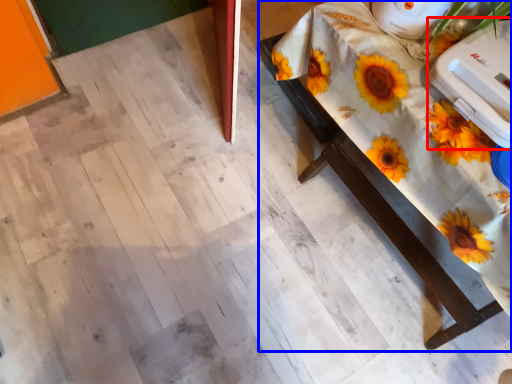
Question: Which object appears closest to the camera in this image, appliance (highlighted by a red box) or table (highlighted by a blue box)?

Choices:
 (A) appliance
 (B) table

Answer: (B)